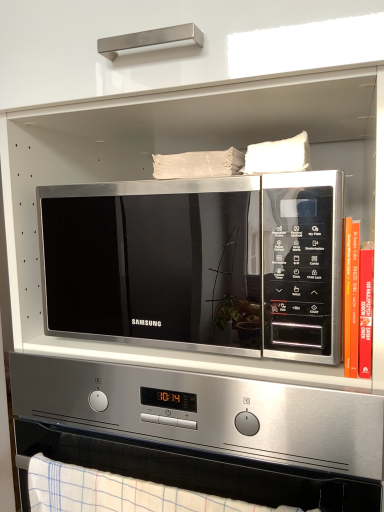
Describe the element at coordinates (204, 432) in the screenshot. I see `satin silver microwave at center` at that location.

At what (x,y) coordinates should I click in order to perform the action: click on satin silver microwave at center. Please return your answer as a coordinate pair (x, y). Image resolution: width=384 pixels, height=512 pixels. Looking at the image, I should click on (195, 263).

From a real-world perspective, is white checkered towel at lower center under satin silver microwave at center?

Yes.

Which of these two, white checkered towel at lower center or satin silver microwave at center, stands shorter?

white checkered towel at lower center is shorter.

Is point (174, 492) positioned behind point (226, 291)?

Yes, it is.

This screenshot has width=384, height=512. I want to click on microwave oven that is above the white checkered towel at lower center (from a real-world perspective), so click(x=195, y=263).

Between hardcover book at right and satin silver microwave at center, which one has larger size?

satin silver microwave at center is bigger.

This screenshot has width=384, height=512. In order to click on book behind the satin silver microwave at center in this screenshot , I will do `click(351, 296)`.

Is hardcover book at right positioned before satin silver microwave at center?

No.

Would you say hardcover book at right is inside or outside satin silver microwave at center?

hardcover book at right is outside satin silver microwave at center.

Is satin silver microwave at center to the left of hardcover book at right from the viewer's perspective?

Indeed, satin silver microwave at center is positioned on the left side of hardcover book at right.

Considering the sizes of objects satin silver microwave at center and hardcover book at right in the image provided, who is shorter, satin silver microwave at center or hardcover book at right?

With less height is hardcover book at right.

From a real-world perspective, is satin silver microwave at center physically located above or below hardcover book at right?

satin silver microwave at center is below hardcover book at right.

Between point (264, 327) and point (345, 252), which one is positioned in front?

Point (345, 252)

How different are the orientations of satin silver microwave at center and hardcover book at right in degrees?

They differ by 0.622 degrees in their facing directions.

Are satin silver microwave at center and hardcover book at right located far from each other?

Actually, satin silver microwave at center and hardcover book at right are a little close together.

Is white checkered towel at lower center looking in the opposite direction of hardcover book at right?

No, hardcover book at right is not at the back of white checkered towel at lower center.

Is there a large distance between white checkered towel at lower center and hardcover book at right?

white checkered towel at lower center is actually quite close to hardcover book at right.

Between white checkered towel at lower center and satin silver microwave at center, which one appears on the left side from the viewer's perspective?

From the viewer's perspective, white checkered towel at lower center appears more on the left side.

Looking at the image, does white checkered towel at lower center seem bigger or smaller compared to satin silver microwave at center?

white checkered towel at lower center is smaller than satin silver microwave at center.

At what (x,y) coordinates should I click in order to perform the action: click on appliance that is behind the white checkered towel at lower center. Please return your answer as a coordinate pair (x, y). Image resolution: width=384 pixels, height=512 pixels. Looking at the image, I should click on point(204,432).

Is white checkered towel at lower center facing away from satin silver microwave at center?

Absolutely, white checkered towel at lower center is directed away from satin silver microwave at center.

Which object is wider, satin silver microwave at center or white checkered towel at lower center?

Wider between the two is satin silver microwave at center.

From the image's perspective, is satin silver microwave at center on top of white checkered towel at lower center?

Indeed, from the image's perspective, satin silver microwave at center is shown above white checkered towel at lower center.

Is satin silver microwave at center taller or shorter than white checkered towel at lower center?

Considering their sizes, satin silver microwave at center has more height than white checkered towel at lower center.

Are satin silver microwave at center and white checkered towel at lower center beside each other?

No, satin silver microwave at center is not touching white checkered towel at lower center.

Image resolution: width=384 pixels, height=512 pixels. I want to click on blanket below the satin silver microwave at center (from a real-world perspective), so click(118, 493).

Identify the location of microwave oven in front of the hardcover book at right. The width and height of the screenshot is (384, 512). (195, 263).

Which object lies further to the anchor point hardcover book at right, white checkered towel at lower center or satin silver microwave at center?

white checkered towel at lower center is further to hardcover book at right.

When comparing their distances from satin silver microwave at center, does satin silver microwave at center or hardcover book at right seem further?

hardcover book at right.

Considering their positions, is satin silver microwave at center positioned further to hardcover book at right than satin silver microwave at center?

Among the two, satin silver microwave at center is located further to hardcover book at right.

Which object lies nearer to the anchor point satin silver microwave at center, satin silver microwave at center or hardcover book at right?

Based on the image, satin silver microwave at center appears to be nearer to satin silver microwave at center.

Estimate the real-world distances between objects in this image. Which object is closer to white checkered towel at lower center, hardcover book at right or satin silver microwave at center?

Answer: Based on the image, satin silver microwave at center appears to be nearer to white checkered towel at lower center.

Based on their spatial positions, is hardcover book at right or white checkered towel at lower center closer to satin silver microwave at center?

The object closer to satin silver microwave at center is white checkered towel at lower center.

Which object lies nearer to the anchor point satin silver microwave at center, satin silver microwave at center or white checkered towel at lower center?

satin silver microwave at center lies closer to satin silver microwave at center than the other object.

Considering their positions, is satin silver microwave at center positioned closer to hardcover book at right than white checkered towel at lower center?

Among the two, satin silver microwave at center is located nearer to hardcover book at right.

Locate an element on the screen. book that lies between satin silver microwave at center and white checkered towel at lower center from top to bottom is located at coordinates (351, 296).

I want to click on book between satin silver microwave at center and satin silver microwave at center vertically, so click(x=351, y=296).

Locate an element on the screen. blanket between satin silver microwave at center and satin silver microwave at center from top to bottom is located at coordinates (118, 493).

The image size is (384, 512). I want to click on blanket that lies between hardcover book at right and satin silver microwave at center from top to bottom, so click(118, 493).